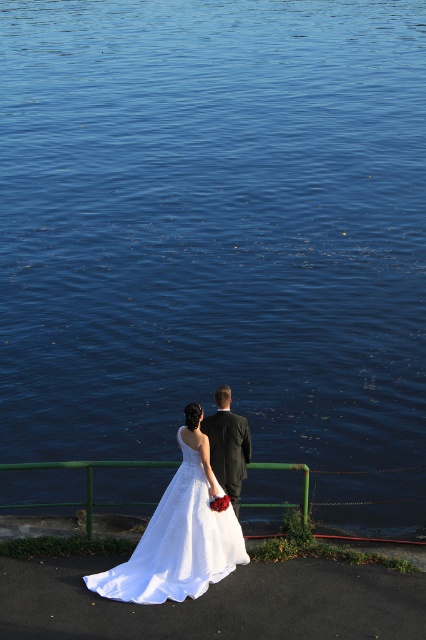
Question: Is the position of shiny black suit at center more distant than that of green painted metal railing at lower center?

Choices:
 (A) yes
 (B) no

Answer: (B)

Question: Observing the image, what is the correct spatial positioning of shiny black suit at center in reference to green painted metal railing at lower center?

Choices:
 (A) above
 (B) below

Answer: (A)

Question: Does white satin dress at lower center appear under shiny black suit at center?

Choices:
 (A) no
 (B) yes

Answer: (B)

Question: Which is nearer to the green painted metal railing at lower center?

Choices:
 (A) shiny black suit at center
 (B) white satin dress at lower center

Answer: (B)

Question: Among these objects, which one is nearest to the camera?

Choices:
 (A) shiny black suit at center
 (B) white satin dress at lower center
 (C) green painted metal railing at lower center

Answer: (B)

Question: Which of these objects is positioned farthest from the white satin dress at lower center?

Choices:
 (A) green painted metal railing at lower center
 (B) shiny black suit at center

Answer: (A)